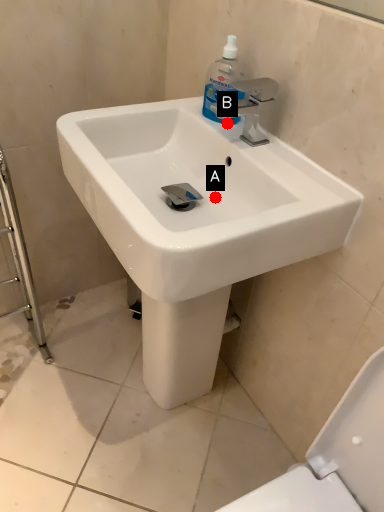
Question: Two points are circled on the image, labeled by A and B beside each circle. Which of the following is the closest to the observer?

Choices:
 (A) A is closer
 (B) B is closer

Answer: (A)